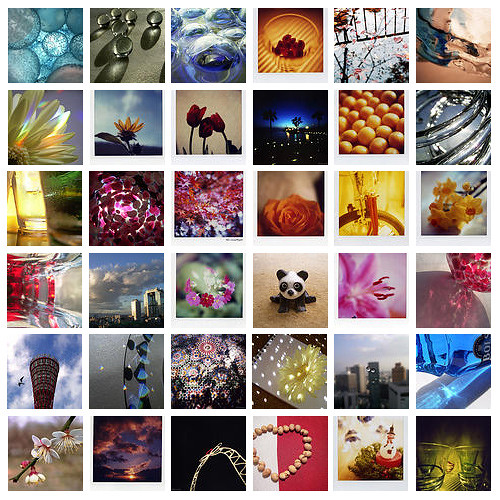
Where is `boxes in 3rd row from right`? The width and height of the screenshot is (500, 500). boxes in 3rd row from right is located at coordinates (295, 454), (291, 382), (297, 299), (299, 214), (293, 127), (290, 60).